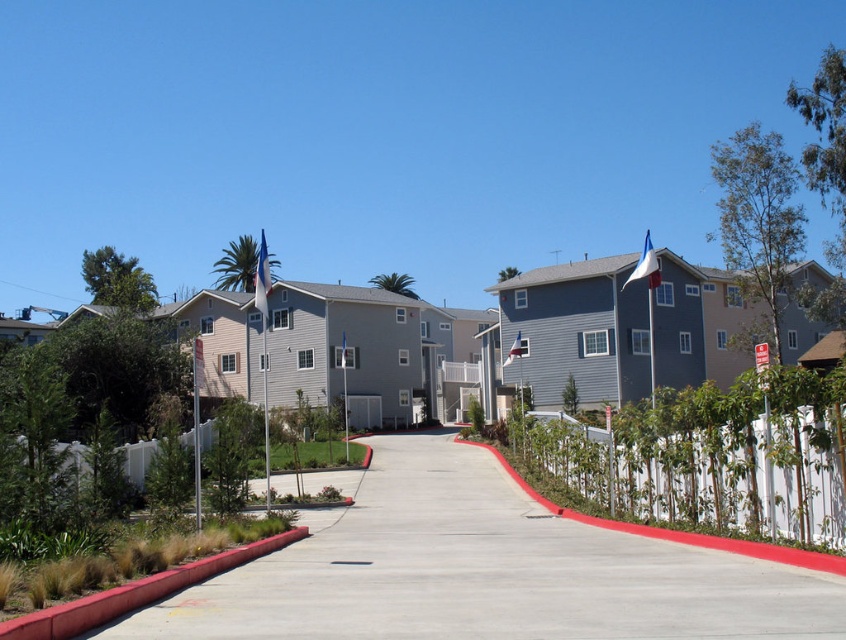
Question: Which point appears closest to the camera in this image?

Choices:
 (A) (698, 477)
 (B) (389, 586)

Answer: (B)

Question: Which point is closer to the camera?

Choices:
 (A) concrete at center
 (B) white wood fence at center right

Answer: (A)

Question: Is concrete at center to the left of white wood fence at center right from the viewer's perspective?

Choices:
 (A) no
 (B) yes

Answer: (B)

Question: Does concrete at center appear under white wood fence at center right?

Choices:
 (A) no
 (B) yes

Answer: (B)

Question: Is concrete at center in front of white wood fence at center right?

Choices:
 (A) no
 (B) yes

Answer: (B)